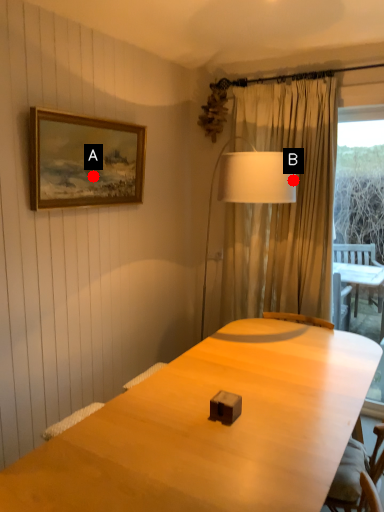
Question: Two points are circled on the image, labeled by A and B beside each circle. Which point appears closest to the camera in this image?

Choices:
 (A) A is closer
 (B) B is closer

Answer: (B)